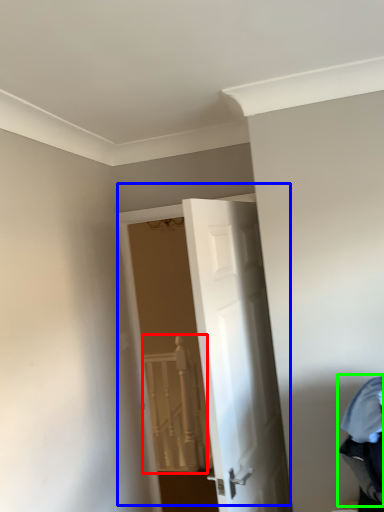
Question: Estimate the real-world distances between objects in this image. Which object is farther from rail (highlighted by a red box), door (highlighted by a blue box) or laundry (highlighted by a green box)?

Choices:
 (A) door
 (B) laundry

Answer: (B)